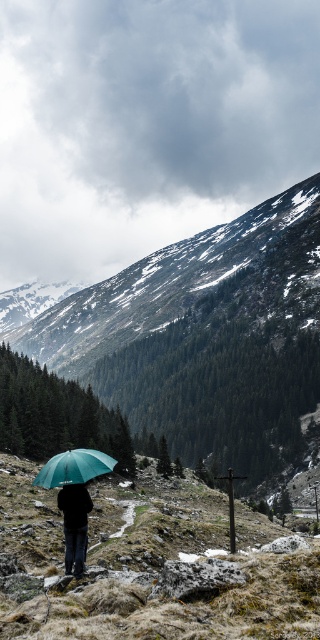
Based on the photo, you are a hiker planning to take a photo of the snowy rocky mountain at center from the position of the green matte umbrella at lower left. Will the mountain be to your left or right side in the photo?

The snowy rocky mountain at center is to the right of the green matte umbrella at lower left, so in the photo taken from the umbrella, the mountain will appear on the right side.

You are a hiker planning to climb the snowy rocky mountain at center. Based on the coordinates provided, where would you start your ascent?

The snowy rocky mountain at center is located at coordinates point (205,337), so you should start your ascent from that point.